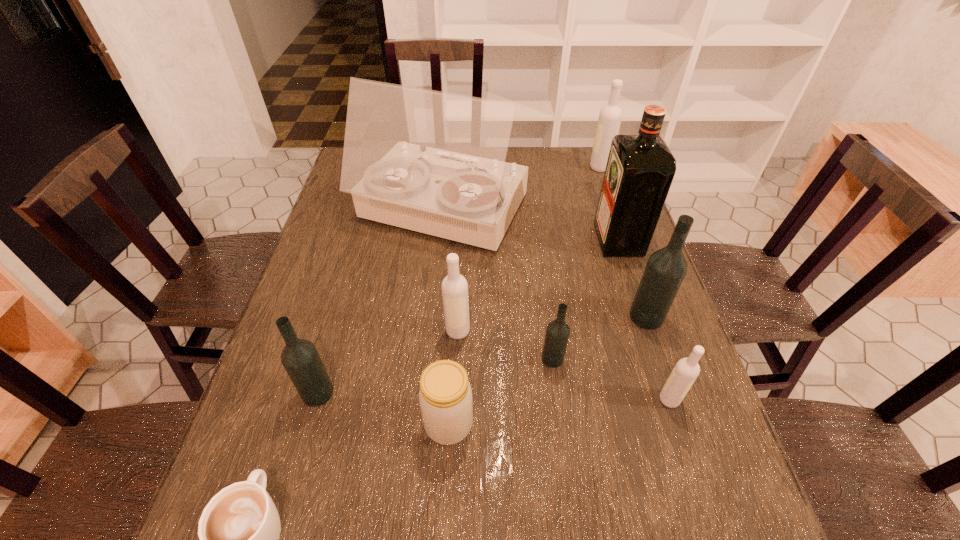
The height and width of the screenshot is (540, 960). What are the coordinates of `liquor` in the screenshot? It's located at (640, 168).

Locate an element on the screen. The height and width of the screenshot is (540, 960). white record player is located at coordinates (433, 162).

Identify the location of the farthest vodka. Image resolution: width=960 pixels, height=540 pixels. (610, 116).

I want to click on the farthest white vodka, so click(x=610, y=116).

You are a GUI agent. You are given a task and a screenshot of the screen. Output one action in this format:
    pyautogui.click(x=<x>, y=<y>)
    Task: Click on the biggest black vodka
    
    Given the screenshot: What is the action you would take?
    pyautogui.click(x=666, y=268)

In order to click on the farthest black vodka in this screenshot , I will do `click(666, 268)`.

At what (x,y) coordinates should I click in order to perform the action: click on the second nearest white vodka. Please return your answer as a coordinate pair (x, y). This screenshot has width=960, height=540. Looking at the image, I should click on (454, 286).

You are a GUI agent. You are given a task and a screenshot of the screen. Output one action in this format:
    pyautogui.click(x=<x>, y=<y>)
    Task: Click on the second biggest white vodka
    
    Given the screenshot: What is the action you would take?
    pyautogui.click(x=454, y=286)

I want to click on the nearest black vodka, so click(300, 358).

Locate an element on the screen. The image size is (960, 540). the second smallest black vodka is located at coordinates (x=300, y=358).